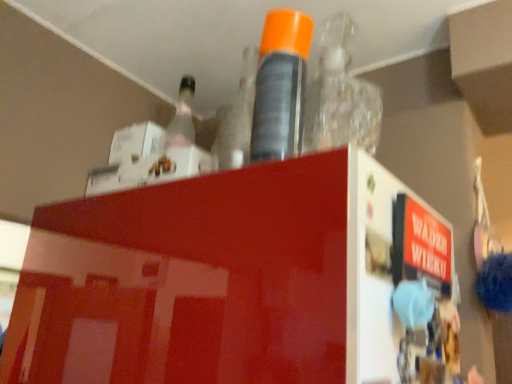
Locate an element on the screen. transparent plastic bottle at upper center, which is the first bottle in right-to-left order is located at coordinates (340, 94).

Looking at this image, how much space does clear plastic bottle at upper center, the third bottle when ordered from right to left, occupy horizontally?

clear plastic bottle at upper center, the third bottle when ordered from right to left, is 1.94 inches wide.

Find the location of a particular element. transparent plastic bottle at upper center, which is the first bottle in right-to-left order is located at coordinates (340, 94).

Is transparent plastic bottle at upper center, which appears as the 3th bottle when viewed from the left, wider than clear plastic bottle at upper center, which is the first bottle from left to right?

Yes, transparent plastic bottle at upper center, which appears as the 3th bottle when viewed from the left, is wider than clear plastic bottle at upper center, which is the first bottle from left to right.

Starting from the clear plastic bottle at upper center, which is the first bottle from left to right, which bottle is the 1st one in front? Please provide its 2D coordinates.

[(340, 94)]

From the picture: How many degrees apart are the facing directions of transparent plastic bottle at upper center, which is the first bottle in right-to-left order, and orange cap spray can at center, which is the second bottle from right to left?

53.2 degrees separate the facing orientations of transparent plastic bottle at upper center, which is the first bottle in right-to-left order, and orange cap spray can at center, which is the second bottle from right to left.

Is transparent plastic bottle at upper center, which appears as the 3th bottle when viewed from the left, beside orange cap spray can at center, the second bottle positioned from the left?

transparent plastic bottle at upper center, which appears as the 3th bottle when viewed from the left, and orange cap spray can at center, the second bottle positioned from the left, are clearly separated.

From the picture: Is transparent plastic bottle at upper center, which appears as the 3th bottle when viewed from the left, completely or partially outside of orange cap spray can at center, which is the second bottle from right to left?

Absolutely, transparent plastic bottle at upper center, which appears as the 3th bottle when viewed from the left, is external to orange cap spray can at center, which is the second bottle from right to left.

How much distance is there between transparent plastic bottle at upper center, which appears as the 3th bottle when viewed from the left, and orange cap spray can at center, which is the second bottle from right to left?

transparent plastic bottle at upper center, which appears as the 3th bottle when viewed from the left, and orange cap spray can at center, which is the second bottle from right to left, are 9.05 inches apart.

Does clear plastic bottle at upper center, which is the first bottle from left to right, have a larger size compared to transparent plastic bottle at upper center, which appears as the 3th bottle when viewed from the left?

Answer: No, clear plastic bottle at upper center, which is the first bottle from left to right, is not bigger than transparent plastic bottle at upper center, which appears as the 3th bottle when viewed from the left.

Based on the photo, is clear plastic bottle at upper center, the third bottle when ordered from right to left, positioned behind transparent plastic bottle at upper center, which is the first bottle in right-to-left order?

Yes, it is behind transparent plastic bottle at upper center, which is the first bottle in right-to-left order.

Can you confirm if clear plastic bottle at upper center, which is the first bottle from left to right, is thinner than transparent plastic bottle at upper center, which appears as the 3th bottle when viewed from the left?

Yes.

Which is correct: orange cap spray can at center, which is the second bottle from right to left, is inside transparent plastic bottle at upper center, which appears as the 3th bottle when viewed from the left, or outside of it?

orange cap spray can at center, which is the second bottle from right to left, is located beyond the bounds of transparent plastic bottle at upper center, which appears as the 3th bottle when viewed from the left.

From a real-world perspective, which object rests below the other?

orange cap spray can at center, the second bottle positioned from the left, is physically lower.

Considering the relative sizes of orange cap spray can at center, the second bottle positioned from the left, and transparent plastic bottle at upper center, which appears as the 3th bottle when viewed from the left, in the image provided, is orange cap spray can at center, the second bottle positioned from the left, thinner than transparent plastic bottle at upper center, which appears as the 3th bottle when viewed from the left,?

Yes.

Does clear plastic bottle at upper center, the third bottle when ordered from right to left, appear on the left side of orange cap spray can at center, which is the second bottle from right to left?

Indeed, clear plastic bottle at upper center, the third bottle when ordered from right to left, is positioned on the left side of orange cap spray can at center, which is the second bottle from right to left.

Where is `bottle below the clear plastic bottle at upper center, the third bottle when ordered from right to left (from a real-world perspective)`? The height and width of the screenshot is (384, 512). bottle below the clear plastic bottle at upper center, the third bottle when ordered from right to left (from a real-world perspective) is located at coordinates (280, 86).

From the image's perspective, would you say clear plastic bottle at upper center, the third bottle when ordered from right to left, is shown under orange cap spray can at center, which is the second bottle from right to left?

Indeed, from the image's perspective, clear plastic bottle at upper center, the third bottle when ordered from right to left, is shown beneath orange cap spray can at center, which is the second bottle from right to left.

Between clear plastic bottle at upper center, the third bottle when ordered from right to left, and orange cap spray can at center, which is the second bottle from right to left, which one is positioned behind?

clear plastic bottle at upper center, the third bottle when ordered from right to left, is more distant.

Is clear plastic bottle at upper center, which is the first bottle from left to right, located within orange cap spray can at center, the second bottle positioned from the left?

Actually, clear plastic bottle at upper center, which is the first bottle from left to right, is outside orange cap spray can at center, the second bottle positioned from the left.

Which object is more forward, orange cap spray can at center, which is the second bottle from right to left, or clear plastic bottle at upper center, the third bottle when ordered from right to left?

orange cap spray can at center, which is the second bottle from right to left, is more forward.

Is point (280, 154) less distant than point (196, 152)?

That is True.

Which of these two, orange cap spray can at center, the second bottle positioned from the left, or clear plastic bottle at upper center, which is the first bottle from left to right, is bigger?

clear plastic bottle at upper center, which is the first bottle from left to right, is bigger.

Find the location of a particular element. bottle above the clear plastic bottle at upper center, which is the first bottle from left to right (from a real-world perspective) is located at coordinates (340, 94).

Locate an element on the screen. The height and width of the screenshot is (384, 512). the 1st bottle below the orange cap spray can at center, which is the second bottle from right to left (from the image's perspective) is located at coordinates (340, 94).

When comparing their distances from transparent plastic bottle at upper center, which is the first bottle in right-to-left order, does clear plastic bottle at upper center, which is the first bottle from left to right, or orange cap spray can at center, which is the second bottle from right to left, seem closer?

The object closer to transparent plastic bottle at upper center, which is the first bottle in right-to-left order, is orange cap spray can at center, which is the second bottle from right to left.

Which object lies further to the anchor point orange cap spray can at center, which is the second bottle from right to left, transparent plastic bottle at upper center, which appears as the 3th bottle when viewed from the left, or clear plastic bottle at upper center, which is the first bottle from left to right?

clear plastic bottle at upper center, which is the first bottle from left to right.

When comparing their distances from clear plastic bottle at upper center, which is the first bottle from left to right, does orange cap spray can at center, which is the second bottle from right to left, or transparent plastic bottle at upper center, which appears as the 3th bottle when viewed from the left, seem closer?

orange cap spray can at center, which is the second bottle from right to left, is positioned closer to the anchor clear plastic bottle at upper center, which is the first bottle from left to right.

Estimate the real-world distances between objects in this image. Which object is closer to orange cap spray can at center, which is the second bottle from right to left, clear plastic bottle at upper center, the third bottle when ordered from right to left, or transparent plastic bottle at upper center, which is the first bottle in right-to-left order?

The object closer to orange cap spray can at center, which is the second bottle from right to left, is transparent plastic bottle at upper center, which is the first bottle in right-to-left order.

Looking at the image, which one is located closer to transparent plastic bottle at upper center, which is the first bottle in right-to-left order, orange cap spray can at center, which is the second bottle from right to left, or clear plastic bottle at upper center, which is the first bottle from left to right?

orange cap spray can at center, which is the second bottle from right to left, is closer to transparent plastic bottle at upper center, which is the first bottle in right-to-left order.

Which object lies further to the anchor point clear plastic bottle at upper center, which is the first bottle from left to right, transparent plastic bottle at upper center, which appears as the 3th bottle when viewed from the left, or orange cap spray can at center, the second bottle positioned from the left?

transparent plastic bottle at upper center, which appears as the 3th bottle when viewed from the left, is positioned further to the anchor clear plastic bottle at upper center, which is the first bottle from left to right.

You are a GUI agent. You are given a task and a screenshot of the screen. Output one action in this format:
    pyautogui.click(x=<x>, y=<y>)
    Task: Click on the bottle between clear plastic bottle at upper center, which is the first bottle from left to right, and transparent plastic bottle at upper center, which is the first bottle in right-to-left order, from left to right
    The image size is (512, 384).
    Given the screenshot: What is the action you would take?
    pyautogui.click(x=280, y=86)